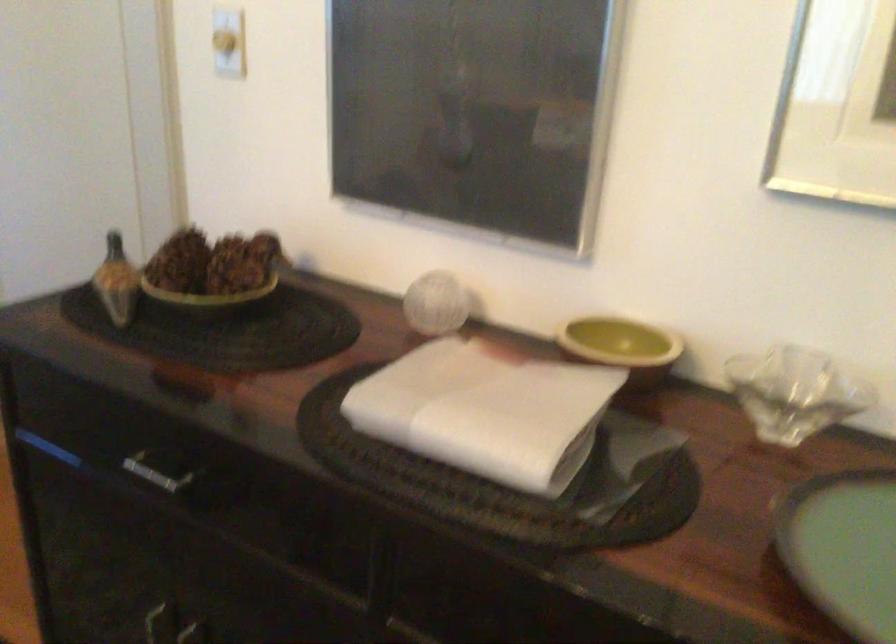
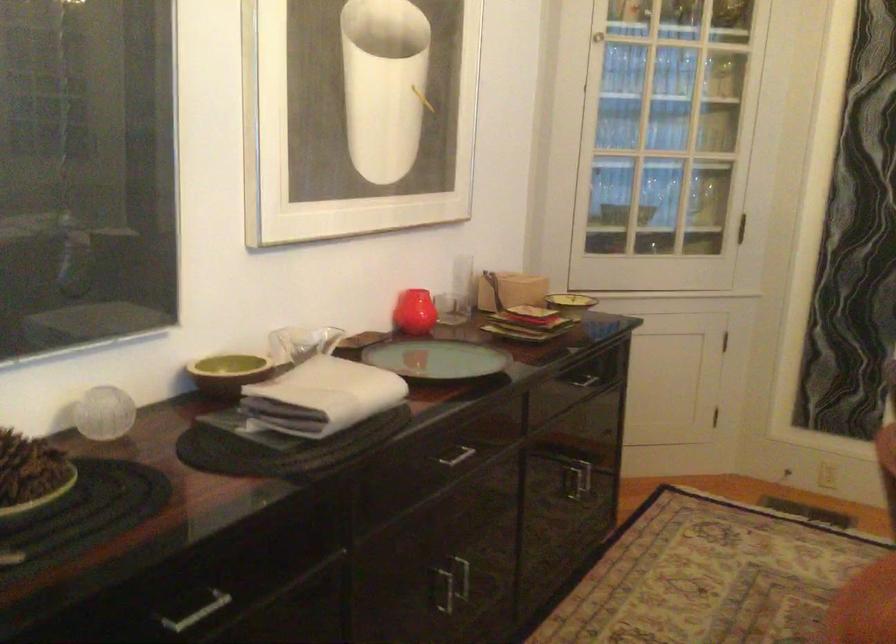
Where in the second image is the point corresponding to point (165, 281) from the first image?

(30, 475)